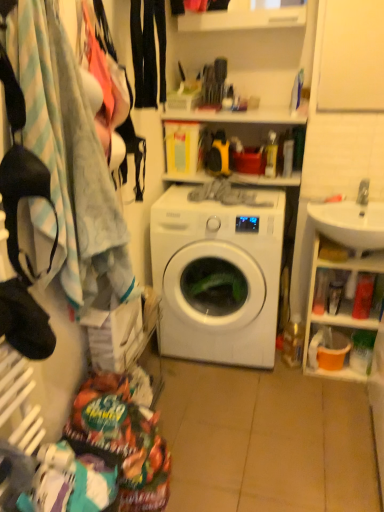
Question: Is white glossy cabinet at right surrounding white glossy washing machine at center?

Choices:
 (A) yes
 (B) no

Answer: (B)

Question: Does white glossy cabinet at right have a lesser height compared to white glossy washing machine at center?

Choices:
 (A) yes
 (B) no

Answer: (A)

Question: Is white glossy cabinet at right beside white glossy washing machine at center?

Choices:
 (A) yes
 (B) no

Answer: (B)

Question: Does white glossy cabinet at right have a larger size compared to white glossy washing machine at center?

Choices:
 (A) yes
 (B) no

Answer: (B)

Question: Considering the relative sizes of white glossy cabinet at right and white glossy washing machine at center in the image provided, is white glossy cabinet at right taller than white glossy washing machine at center?

Choices:
 (A) no
 (B) yes

Answer: (A)

Question: Looking at their shapes, would you say white glossy sink at right is wider or thinner than white glossy washing machine at center?

Choices:
 (A) thin
 (B) wide

Answer: (A)

Question: Considering the positions of white glossy sink at right and white glossy washing machine at center in the image, is white glossy sink at right taller or shorter than white glossy washing machine at center?

Choices:
 (A) tall
 (B) short

Answer: (B)

Question: Is point (309, 203) closer or farther from the camera than point (208, 334)?

Choices:
 (A) farther
 (B) closer

Answer: (A)

Question: Looking at the image, does white glossy sink at right seem bigger or smaller compared to white glossy washing machine at center?

Choices:
 (A) big
 (B) small

Answer: (B)

Question: From their relative heights in the image, would you say white glossy cabinet at right is taller or shorter than black smooth pants at upper center?

Choices:
 (A) tall
 (B) short

Answer: (A)

Question: Considering the positions of point (324, 373) and point (163, 37), is point (324, 373) closer or farther from the camera than point (163, 37)?

Choices:
 (A) closer
 (B) farther

Answer: (B)

Question: Looking at the image, does white glossy cabinet at right seem bigger or smaller compared to black smooth pants at upper center?

Choices:
 (A) big
 (B) small

Answer: (A)

Question: In the image, is white glossy cabinet at right positioned in front of or behind black smooth pants at upper center?

Choices:
 (A) front
 (B) behind

Answer: (B)

Question: From a real-world perspective, is white glossy washing machine at center positioned above or below white glossy cabinet at right?

Choices:
 (A) below
 (B) above

Answer: (B)

Question: Is white glossy washing machine at center wider or thinner than white glossy cabinet at right?

Choices:
 (A) wide
 (B) thin

Answer: (A)